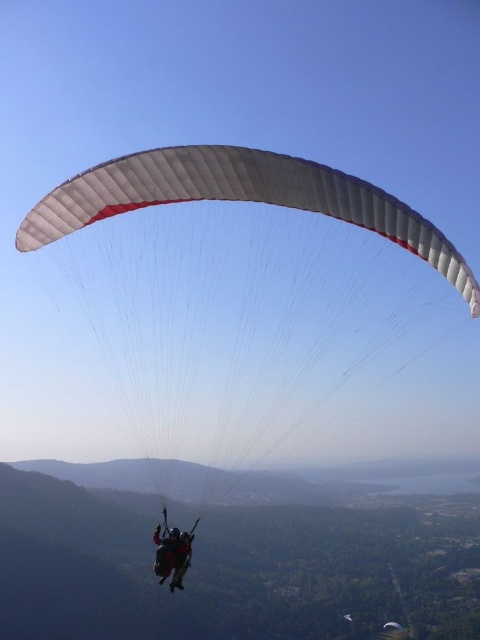
Who is taller, white matte parachute at center or black fabric parachute at center?

white matte parachute at center is taller.

Between point (387, 214) and point (160, 556), which one is positioned behind?

The point (160, 556) is behind.

You are a GUI agent. You are given a task and a screenshot of the screen. Output one action in this format:
    pyautogui.click(x=<x>, y=<y>)
    Task: Click on the white matte parachute at center
    The image size is (480, 640).
    Given the screenshot: What is the action you would take?
    pyautogui.click(x=240, y=301)